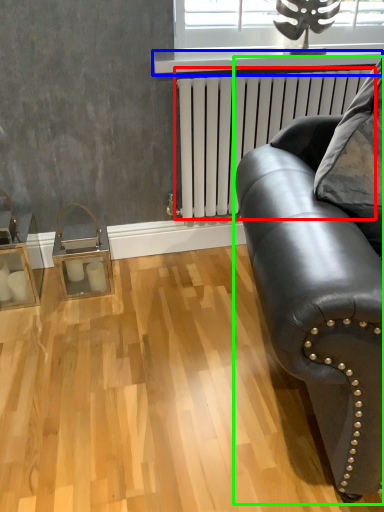
Question: Estimate the real-world distances between objects in this image. Which object is farther from radiator (highlighted by a red box), window sill (highlighted by a blue box) or studio couch (highlighted by a green box)?

Choices:
 (A) window sill
 (B) studio couch

Answer: (B)